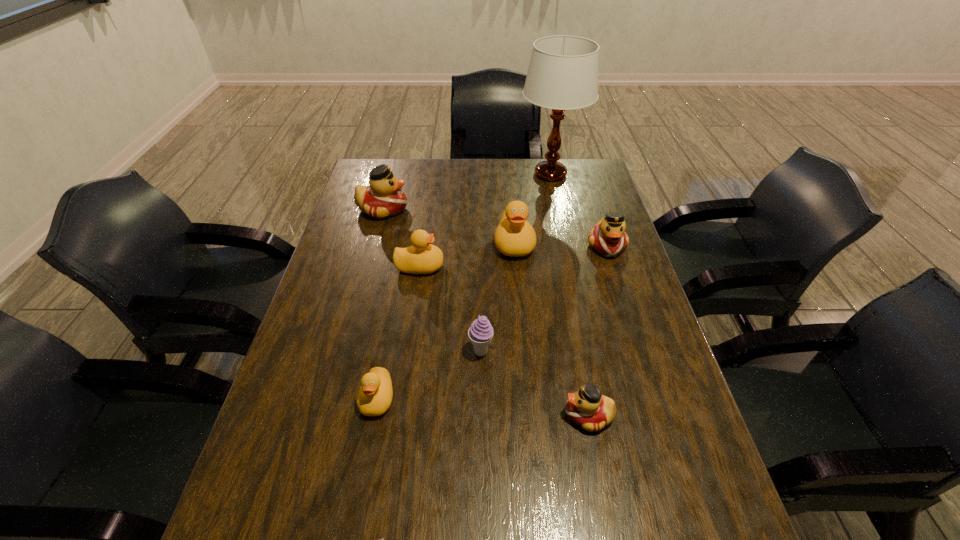
The height and width of the screenshot is (540, 960). In order to click on purple icecream in this screenshot , I will do `click(480, 333)`.

At what (x,y) coordinates should I click in order to perform the action: click on the smallest red duck. Please return your answer as a coordinate pair (x, y). The width and height of the screenshot is (960, 540). Looking at the image, I should click on (592, 411).

Where is `the second duck from right to left`? the second duck from right to left is located at coordinates (592, 411).

Image resolution: width=960 pixels, height=540 pixels. What are the coordinates of `the nearest yellow duck` in the screenshot? It's located at point(374,398).

This screenshot has width=960, height=540. Find the location of `vacant point located on the front of the tallest object`. vacant point located on the front of the tallest object is located at coordinates (561, 219).

Identify the location of vacant area situated 0.170m on the face of the farthest duck. This screenshot has width=960, height=540. (458, 209).

This screenshot has height=540, width=960. Find the location of `vacant space located 0.370m on the face of the third duck from right to left`. vacant space located 0.370m on the face of the third duck from right to left is located at coordinates (525, 366).

Where is `vacant space located 0.230m on the face of the rightmost duck`? vacant space located 0.230m on the face of the rightmost duck is located at coordinates (631, 319).

Find the location of `free space located on the face of the second biggest yellow duck`. free space located on the face of the second biggest yellow duck is located at coordinates (515, 266).

Find the location of a particular element. The height and width of the screenshot is (540, 960). vacant region located 0.160m on the right of the sixth farthest object is located at coordinates point(558,352).